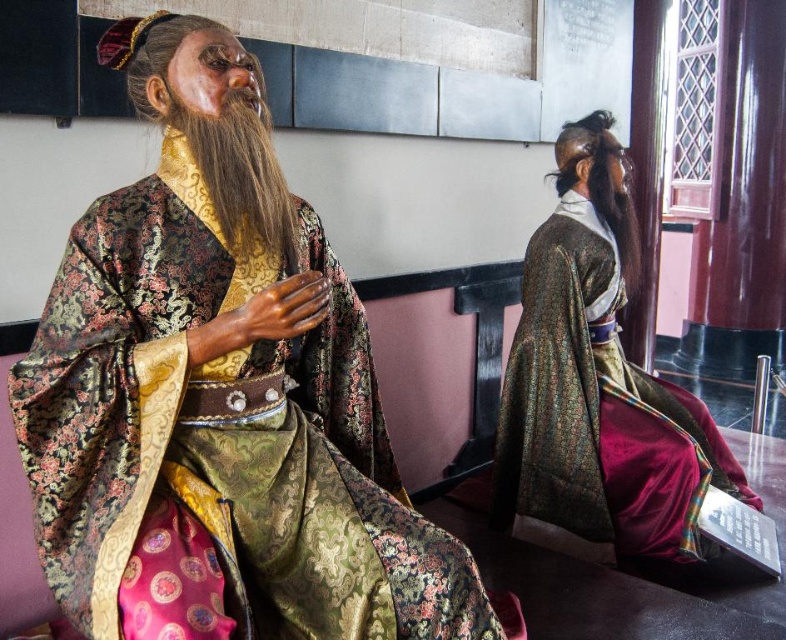
In the image, there are two figures dressed in traditional East Asian attire. The first figure is seated in the foreground, and the second figure is positioned behind and to the right. The gold brocade robe at center is represented by point (222, 435). Which figure is wearing the gold brocade robe at center?

The gold brocade robe at center is represented by point (222, 435), which corresponds to the first figure seated in the foreground.